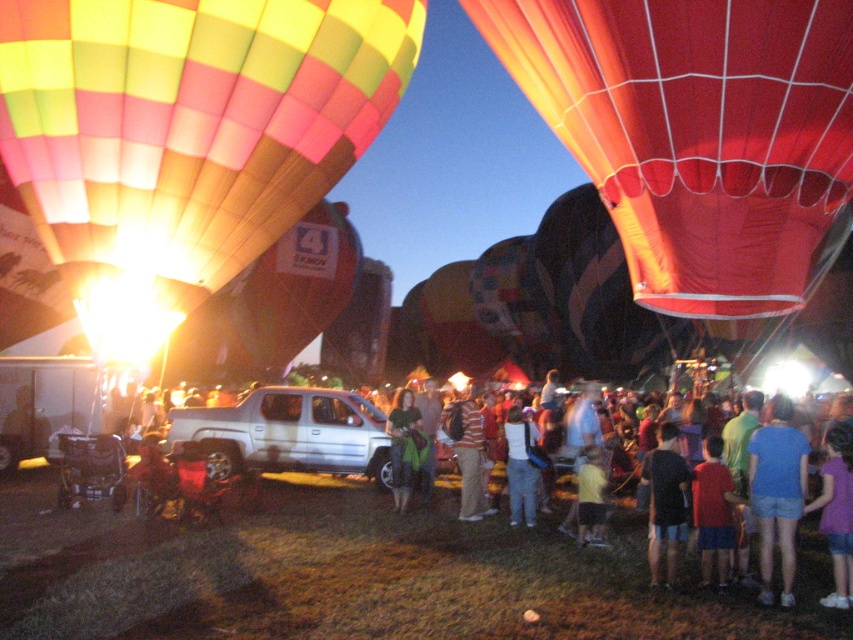
Question: Is orange striped shirt at center wider than yellow matte shirt at center?

Choices:
 (A) no
 (B) yes

Answer: (B)

Question: Is red cotton shirt at center bigger than white cotton shirt at center?

Choices:
 (A) yes
 (B) no

Answer: (B)

Question: Which of the following is the closest to the observer?

Choices:
 (A) (521, 442)
 (B) (843, 67)

Answer: (B)

Question: Which point is closer to the camera?

Choices:
 (A) purple cotton shirt at lower right
 (B) red fabric balloon at upper right

Answer: (B)

Question: Can you confirm if red cotton shirt at center is positioned to the right of green fabric bag at center?

Choices:
 (A) yes
 (B) no

Answer: (A)

Question: Among these objects, which one is nearest to the camera?

Choices:
 (A) white cotton shirt at center
 (B) blue denim shorts at center
 (C) purple cotton shirt at lower right
 (D) yellow matte shirt at center

Answer: (C)